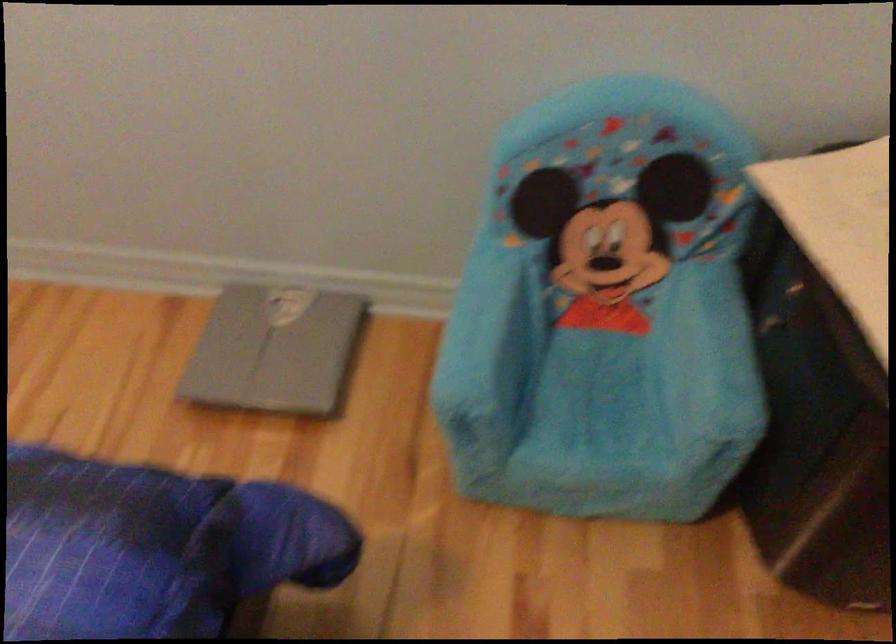
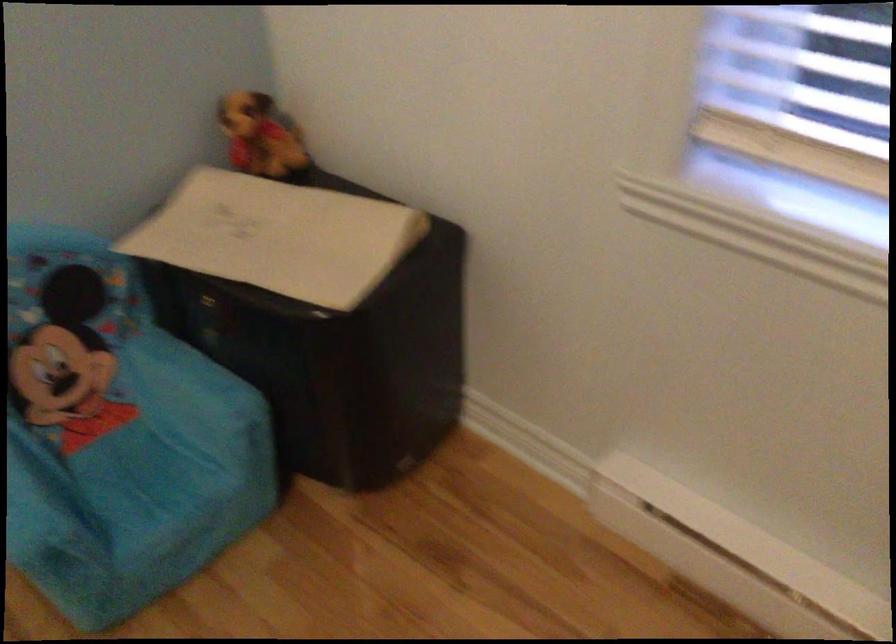
Question: Based on the continuous images, in which direction is the camera rotating? Reply with the corresponding letter.

Choices:
 (A) Left
 (B) Right
 (C) Up
 (D) Down

Answer: (B)